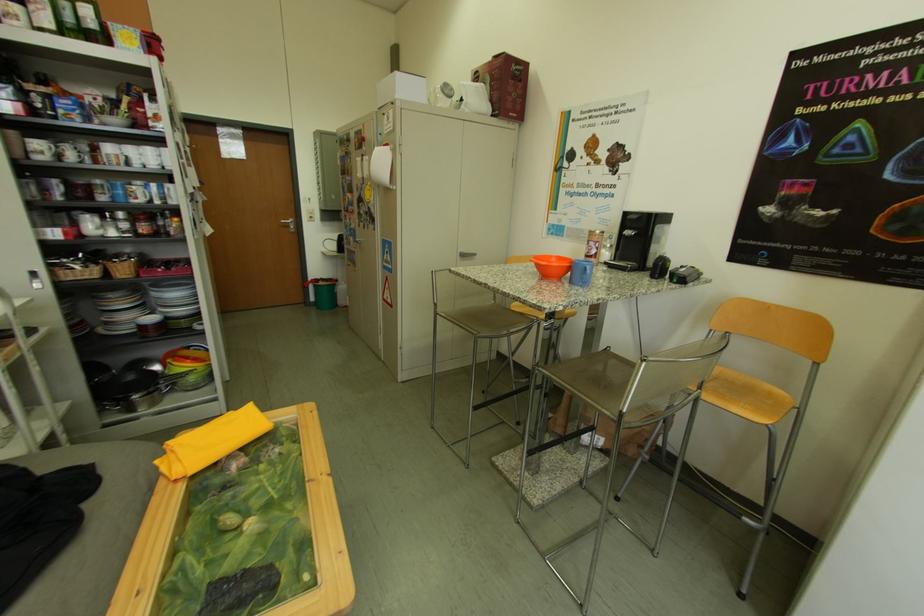
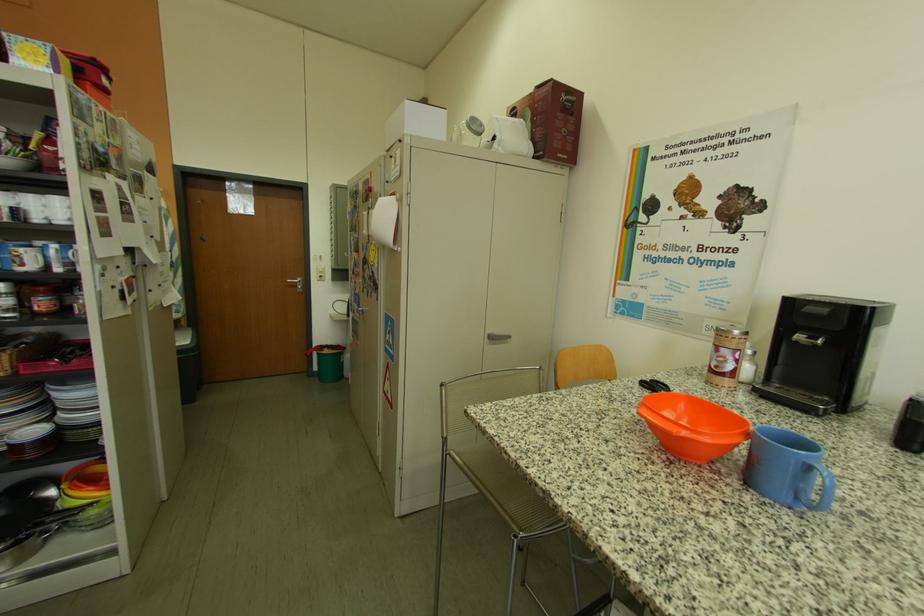
The point at (327,288) is marked in the first image. Where is the corresponding point in the second image?

(331, 357)